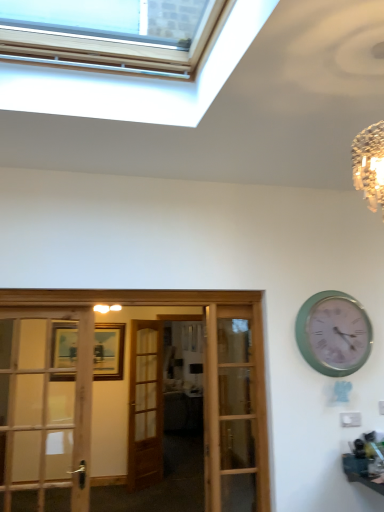
Question: From a real-world perspective, relative to green metallic clock at upper right, is velvet brown couch at center vertically above or below?

Choices:
 (A) above
 (B) below

Answer: (B)

Question: Considering the positions of point (183, 399) and point (354, 307), is point (183, 399) closer or farther from the camera than point (354, 307)?

Choices:
 (A) farther
 (B) closer

Answer: (A)

Question: Which is nearer to the green metallic clock at upper right?

Choices:
 (A) wooden french doors at center
 (B) wooden door at center
 (C) velvet brown couch at center

Answer: (A)

Question: Which object is the farthest from the green metallic clock at upper right?

Choices:
 (A) wooden door at center
 (B) wooden french doors at center
 (C) velvet brown couch at center

Answer: (C)